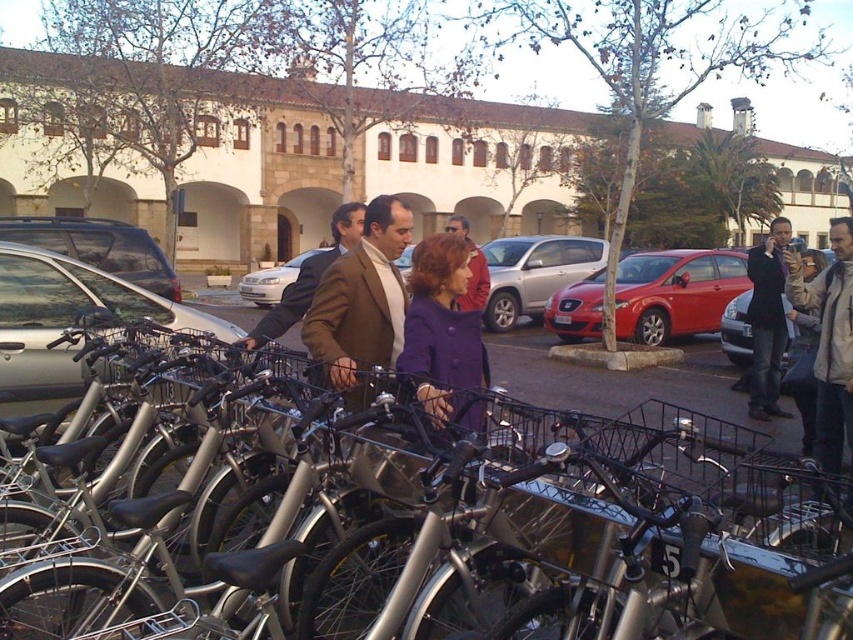
Question: Among these objects, which one is farthest from the camera?

Choices:
 (A) dark brown leather jacket at right
 (B) metallic silver sedan at center
 (C) light gray jacket at right

Answer: (A)

Question: Where is satin silver suv at center located in relation to metallic silver sedan at center in the image?

Choices:
 (A) below
 (B) above

Answer: (B)

Question: Which is nearer to the matte brown coat at center?

Choices:
 (A) shiny red car at center
 (B) satin silver suv at center
 (C) metallic silver car at left

Answer: (C)

Question: Estimate the real-world distances between objects in this image. Which object is closer to the light gray jacket at right?

Choices:
 (A) dark brown leather jacket at right
 (B) silver metallic bicycle at center
 (C) matte brown coat at center

Answer: (A)

Question: Where is metallic silver car at center located in relation to silver metallic car at center in the image?

Choices:
 (A) left
 (B) right

Answer: (B)

Question: Can you confirm if shiny red car at center is positioned to the right of satin silver suv at center?

Choices:
 (A) no
 (B) yes

Answer: (B)